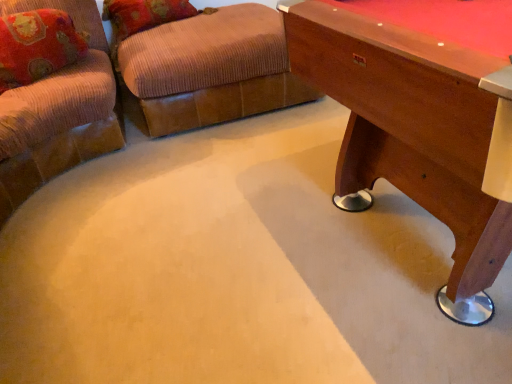
Question: Considering the relative sizes of brown corduroy ottoman at upper center and wooden pool table at right in the image provided, is brown corduroy ottoman at upper center smaller than wooden pool table at right?

Choices:
 (A) yes
 (B) no

Answer: (A)

Question: Can wooden pool table at right be found inside brown corduroy ottoman at upper center?

Choices:
 (A) yes
 (B) no

Answer: (B)

Question: Would you consider brown corduroy ottoman at upper center to be distant from wooden pool table at right?

Choices:
 (A) no
 (B) yes

Answer: (B)

Question: From the image's perspective, does brown corduroy ottoman at upper center appear lower than wooden pool table at right?

Choices:
 (A) no
 (B) yes

Answer: (A)

Question: Is brown corduroy ottoman at upper center bigger than wooden pool table at right?

Choices:
 (A) yes
 (B) no

Answer: (B)

Question: Is velvet floral pillow at upper left wider or thinner than wooden pool table at right?

Choices:
 (A) wide
 (B) thin

Answer: (B)

Question: From the image's perspective, is velvet floral pillow at upper left above or below wooden pool table at right?

Choices:
 (A) below
 (B) above

Answer: (B)

Question: Is velvet floral pillow at upper left situated inside wooden pool table at right or outside?

Choices:
 (A) outside
 (B) inside

Answer: (A)

Question: Is point (56, 67) positioned closer to the camera than point (471, 170)?

Choices:
 (A) closer
 (B) farther

Answer: (B)

Question: Is point (196, 97) closer or farther from the camera than point (9, 23)?

Choices:
 (A) farther
 (B) closer

Answer: (A)

Question: Looking at the image, does brown corduroy ottoman at upper center seem bigger or smaller compared to velvet floral pillow at upper left?

Choices:
 (A) small
 (B) big

Answer: (B)

Question: From a real-world perspective, is brown corduroy ottoman at upper center physically located above or below velvet floral pillow at upper left?

Choices:
 (A) above
 (B) below

Answer: (B)

Question: Based on their positions, is brown corduroy ottoman at upper center located to the left or right of velvet floral pillow at upper left?

Choices:
 (A) left
 (B) right

Answer: (B)

Question: From a real-world perspective, is wooden pool table at right positioned above or below brown corduroy ottoman at upper center?

Choices:
 (A) below
 (B) above

Answer: (B)

Question: From the image's perspective, relative to brown corduroy ottoman at upper center, is wooden pool table at right above or below?

Choices:
 (A) below
 (B) above

Answer: (A)